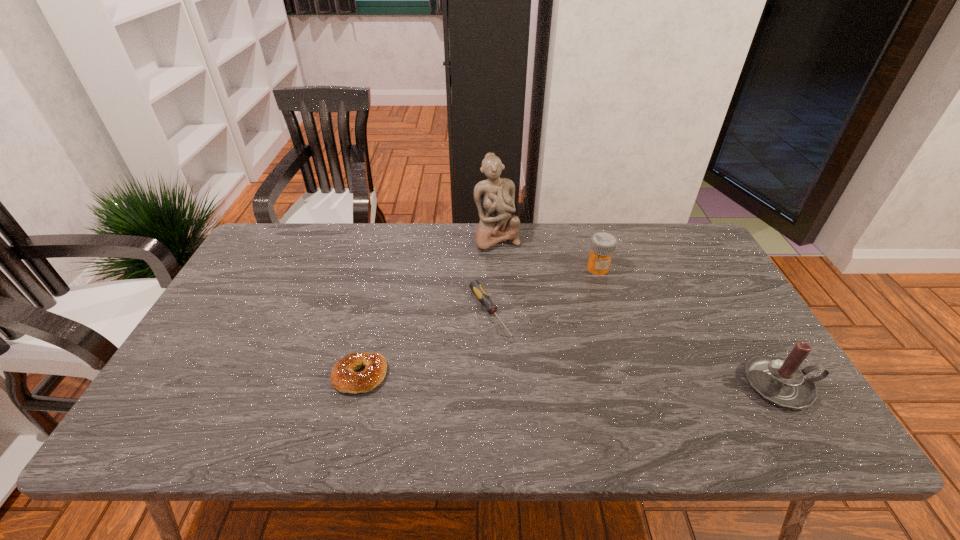
You are a GUI agent. You are given a task and a screenshot of the screen. Output one action in this format:
    pyautogui.click(x=<x>, y=<y>)
    Task: Click on the vacant space situated on the right of the bagel
    The height and width of the screenshot is (540, 960).
    Given the screenshot: What is the action you would take?
    pyautogui.click(x=428, y=376)

This screenshot has width=960, height=540. Identify the location of vacant position located 0.150m insert the third nearest object into a screw head. (530, 380).

Where is `free space located 0.110m insert the third nearest object into a screw head`? The height and width of the screenshot is (540, 960). free space located 0.110m insert the third nearest object into a screw head is located at coordinates (521, 368).

Locate an element on the screen. The image size is (960, 540). vacant area situated insert the third nearest object into a screw head is located at coordinates (545, 403).

Locate an element on the screen. vacant space located on the front-facing side of the farthest object is located at coordinates (521, 296).

At what (x,y) coordinates should I click in order to perform the action: click on free region located 0.050m on the front-facing side of the farthest object. Please return your answer as a coordinate pair (x, y). Looking at the image, I should click on (507, 262).

This screenshot has height=540, width=960. Find the location of `vacant space located 0.090m on the front-facing side of the farthest object`. vacant space located 0.090m on the front-facing side of the farthest object is located at coordinates (510, 269).

In order to click on free space located on the label side of the fourth nearest object in this screenshot , I will do `click(563, 343)`.

The height and width of the screenshot is (540, 960). Find the location of `vacant space situated 0.380m on the label side of the fourth nearest object`. vacant space situated 0.380m on the label side of the fourth nearest object is located at coordinates (552, 366).

The image size is (960, 540). I want to click on blank space located 0.220m on the label side of the fourth nearest object, so click(572, 323).